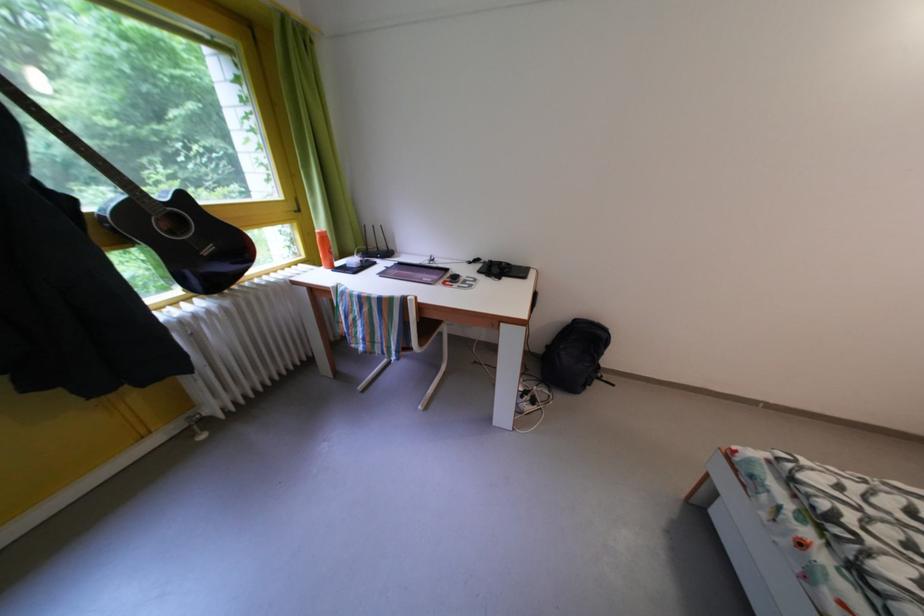
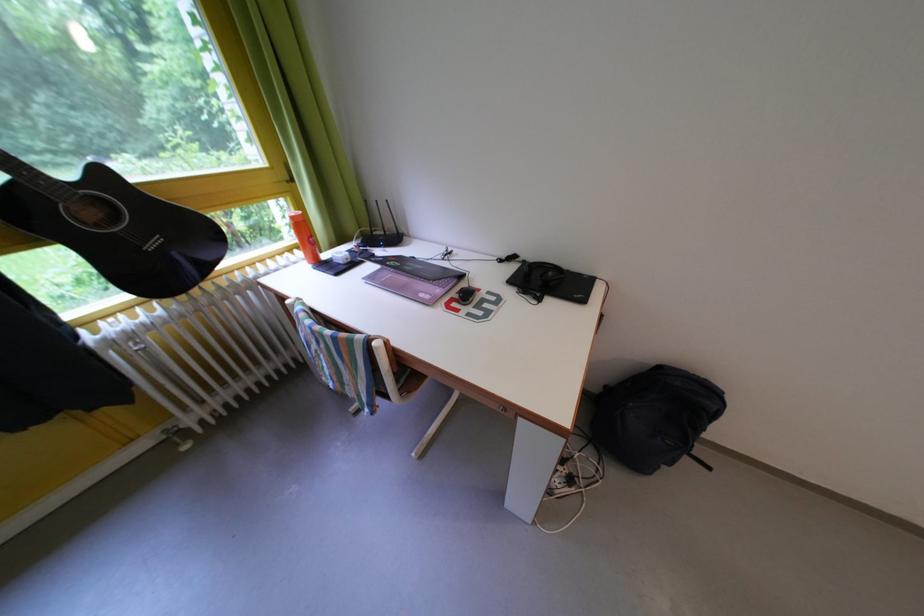
Find the pixel in the second image that matches (x=191, y=203) in the first image.

(112, 179)